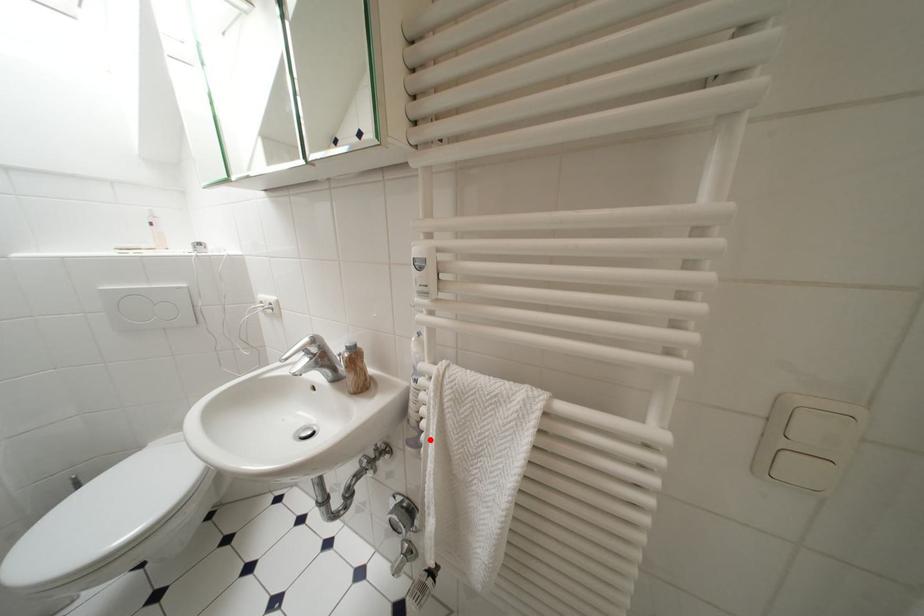
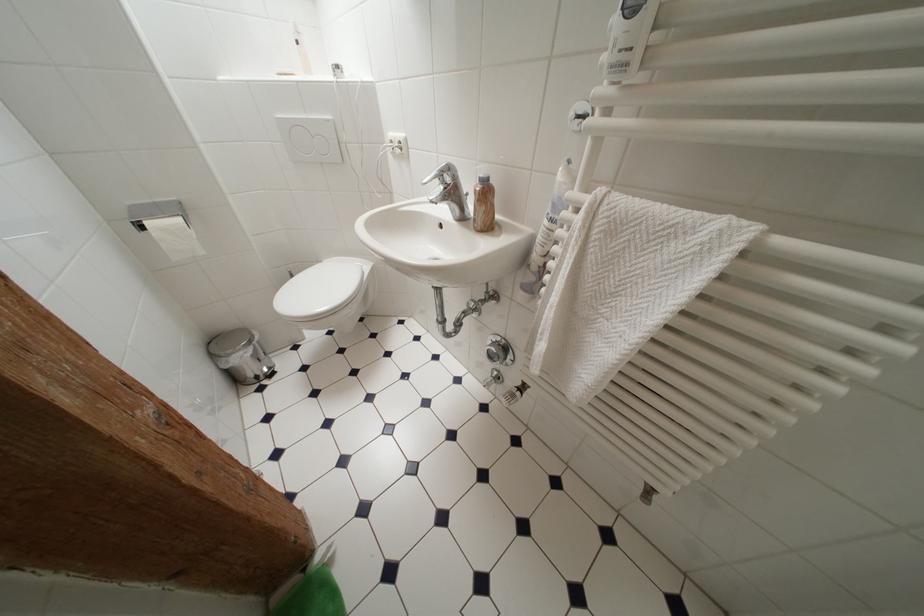
Question: I am providing you with two images of the same scene from different viewpoints. Given a red point in image1, look at the same physical point in image2. Is it:

Choices:
 (A) Closer to the viewpoint
 (B) Farther from the viewpoint

Answer: (A)